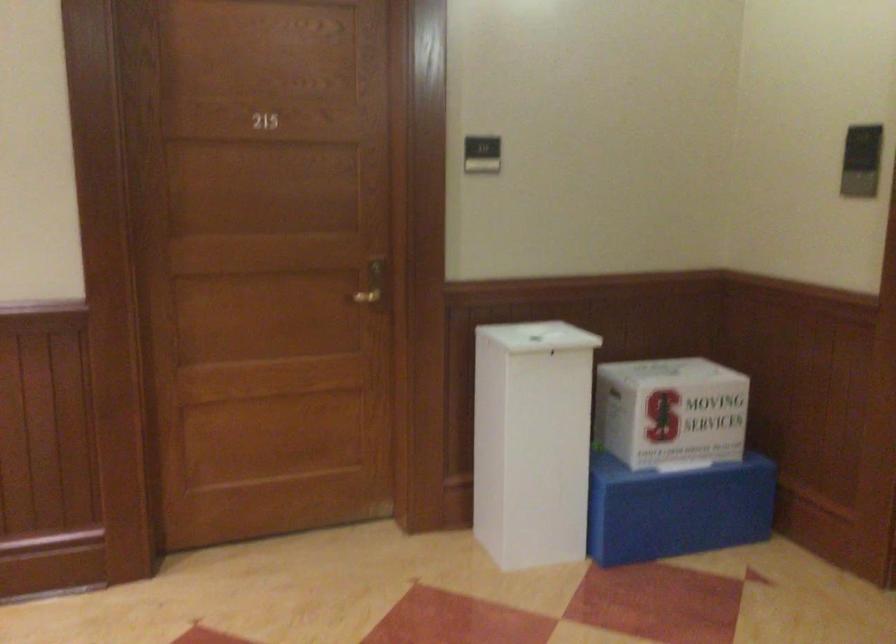
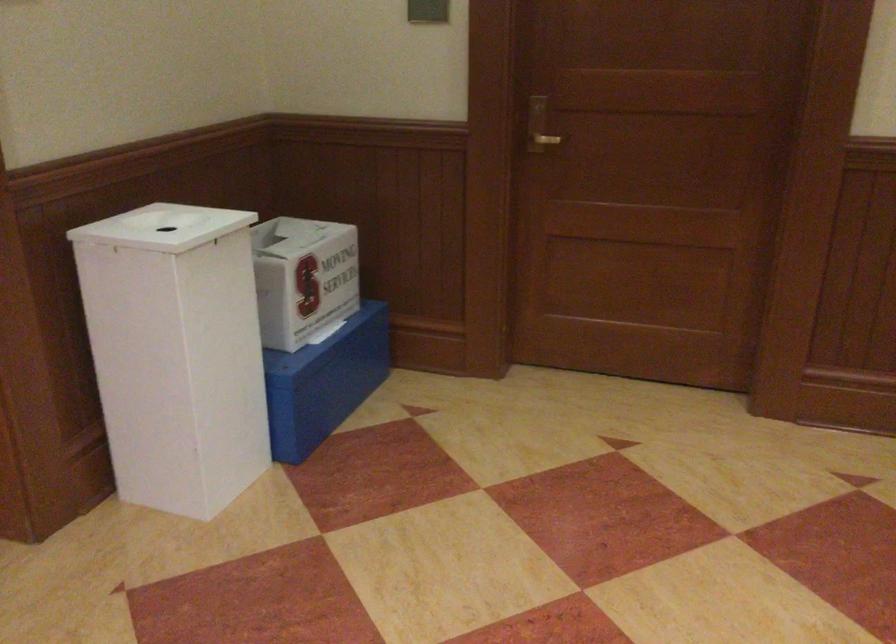
Find the pixel in the second image that matches [543,339] in the first image.

(164, 227)